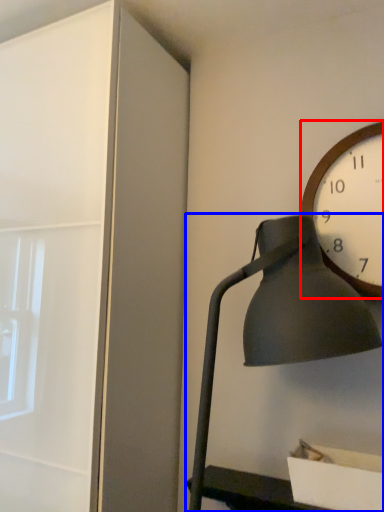
Question: Which of the following is the farthest to the observer, wall clock (highlighted by a red box) or lamp (highlighted by a blue box)?

Choices:
 (A) wall clock
 (B) lamp

Answer: (A)